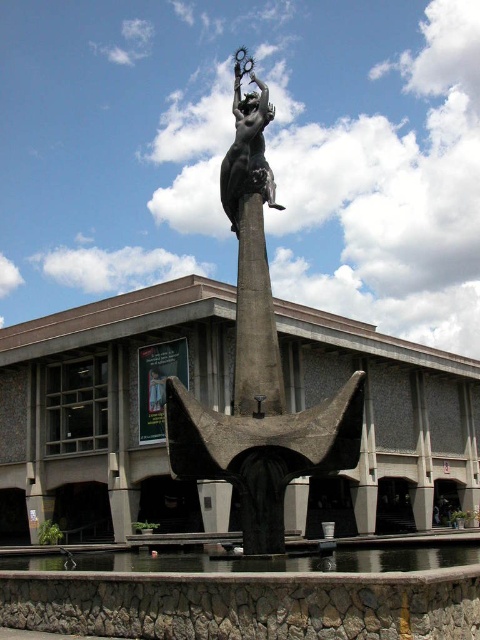
You are standing in front of the sculpture and the building. You notice two points marked on the sculpture. The first point is at coordinates point (265,276) and the second is at point (264,113). From your perspective, which point is closer to you?

Point (265,276) is in front of point (264,113), so it is closer to you.

You are an art student analyzing the sculpture and the building. You notice the bronze statue at center and the slate gray stone pillar at center. Which object is located to the left of the other?

The bronze statue at center is positioned on the left side of the slate gray stone pillar at center.